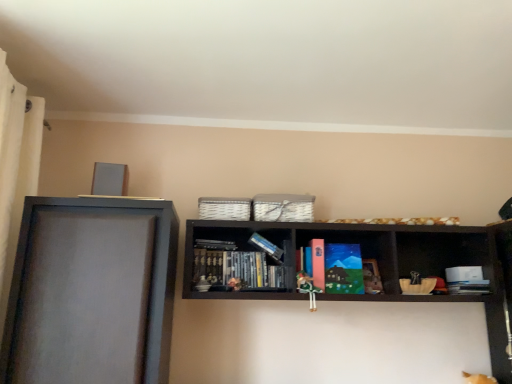
Question: In terms of size, does hardcover book at center, arranged as the second book when viewed from the top, appear bigger or smaller than wooden bookshelf at center, the 1th shelf positioned from the right?

Choices:
 (A) small
 (B) big

Answer: (A)

Question: Would you say hardcover book at center, marked as the 2th book in a left-to-right arrangement, is to the left or to the right of wooden bookshelf at center, the 1th shelf positioned from the right, in the picture?

Choices:
 (A) right
 (B) left

Answer: (A)

Question: Estimate the real-world distances between objects in this image. Which object is closer to the matte gray frame at left, positioned as the 1th shelf in left-to-right order?

Choices:
 (A) green fabric doll at center
 (B) black matte bookshelf at center, which is the second book in bottom-to-top order
 (C) matte paperback book at center
 (D) wooden bookshelf at center, which is the second shelf from left to right
 (E) hardcover book at center, which appears as the first book when ordered from the bottom

Answer: (B)

Question: Based on their relative distances, which object is farther from the green fabric doll at center?

Choices:
 (A) matte gray frame at left, the 2th shelf positioned from the right
 (B) hardcover book at center, arranged as the second book when viewed from the top
 (C) wooden bookshelf at center, the 1th shelf positioned from the right
 (D) matte paperback book at center
 (E) black matte bookshelf at center, the second book positioned from the right

Answer: (A)